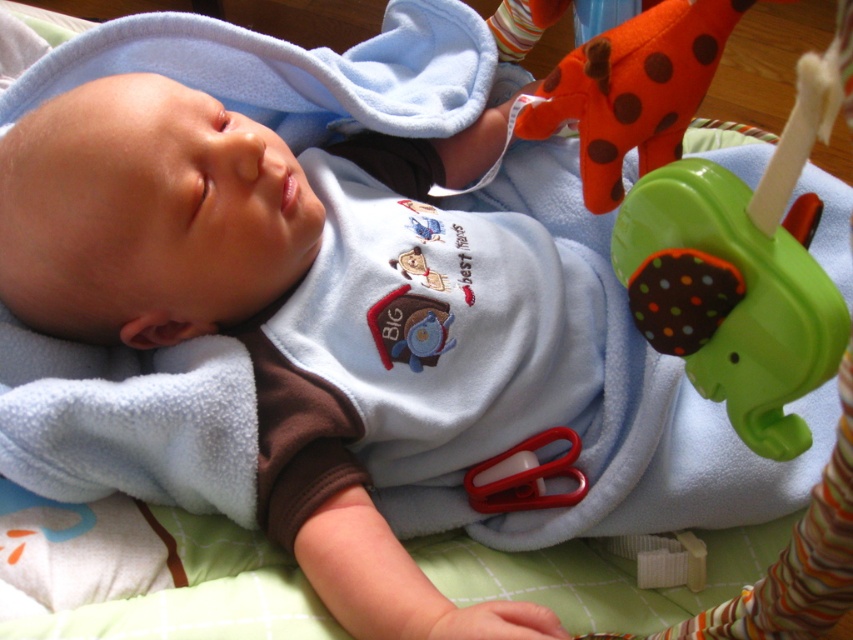
Who is higher up, green plastic elephant at upper right or matte plastic teething ring at center?

matte plastic teething ring at center

Can you confirm if green plastic elephant at upper right is taller than matte plastic teething ring at center?

Indeed, green plastic elephant at upper right has a greater height compared to matte plastic teething ring at center.

Between point (701, 314) and point (280, 205), which one is positioned behind?

The point (280, 205) is behind.

Find the location of `green plastic elephant at upper right`. green plastic elephant at upper right is located at coordinates (738, 276).

Between orange felt giraffe at upper right and matte plastic teething ring at center, which one is positioned lower?

matte plastic teething ring at center is below.

Which is in front, point (601, 172) or point (294, 195)?

Positioned in front is point (601, 172).

Which is in front, point (610, 148) or point (294, 208)?

Point (610, 148) is more forward.

Where is `orange felt giraffe at upper right`? orange felt giraffe at upper right is located at coordinates (633, 90).

Is point (683, 179) more distant than point (645, 145)?

No, (683, 179) is closer to viewer.

Which is in front, point (805, 314) or point (669, 86)?

Point (805, 314) is in front.

Locate an element on the screen. green plastic elephant at upper right is located at coordinates (738, 276).

At what (x,y) coordinates should I click in order to perform the action: click on green plastic elephant at upper right. Please return your answer as a coordinate pair (x, y). This screenshot has height=640, width=853. Looking at the image, I should click on (738, 276).